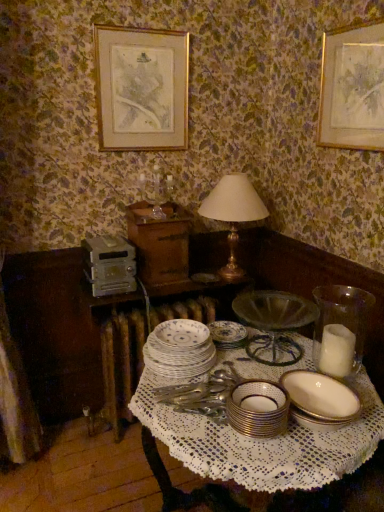
Identify the location of vacant area on top of white porcelain plates at center, which is counted as the 1th tableware, starting from the left (from a real-world perspective). This screenshot has height=512, width=384. (177, 340).